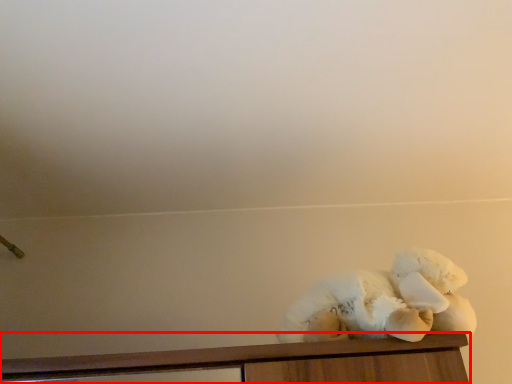
Question: Where is furniture (annotated by the red box) located in relation to teddy bear in the image?

Choices:
 (A) left
 (B) right

Answer: (A)